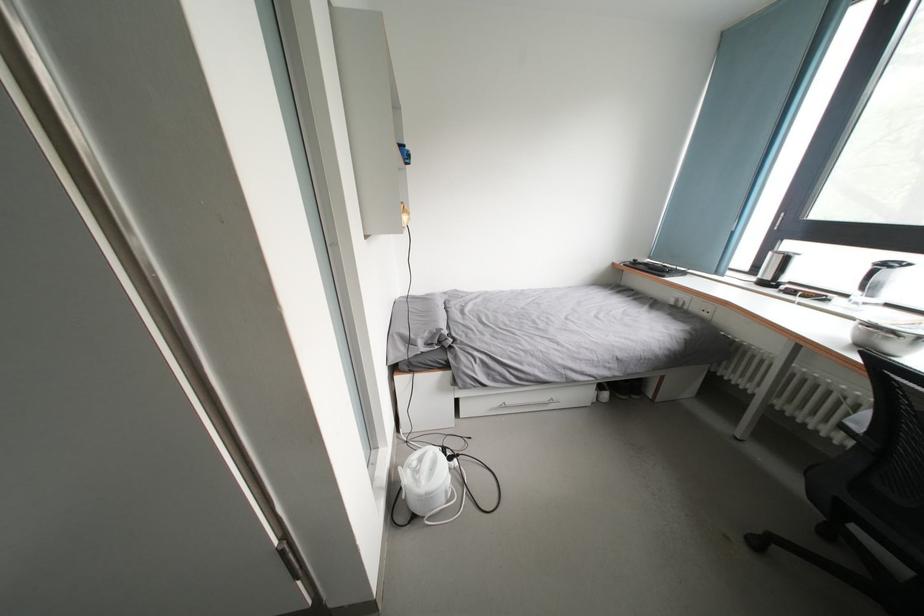
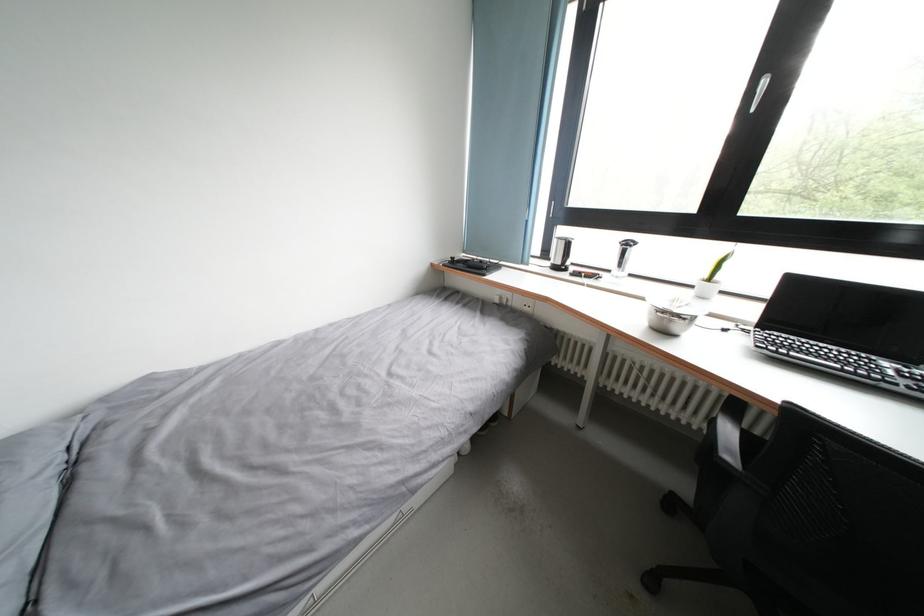
In the second image, find the point that corresponds to (x=684, y=305) in the first image.

(507, 302)